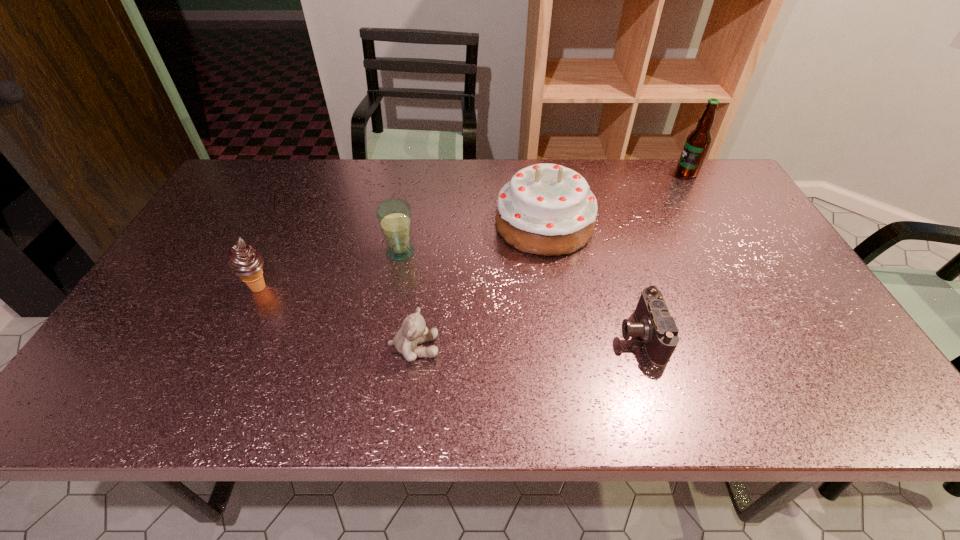
Locate an element on the screen. The height and width of the screenshot is (540, 960). free space located 0.050m on the label of the beer bottle is located at coordinates (660, 173).

This screenshot has height=540, width=960. Identify the location of free location located on the back of the second tallest object. (538, 185).

Image resolution: width=960 pixels, height=540 pixels. What are the coordinates of `vacant space situated on the back of the leftmost object` in the screenshot? It's located at (x=276, y=251).

This screenshot has height=540, width=960. What are the coordinates of `vacant space located on the front of the glass` in the screenshot? It's located at (383, 348).

Find the location of `free space located 0.300m on the face of the teddy bear`. free space located 0.300m on the face of the teddy bear is located at coordinates (574, 348).

Where is `free space located 0.100m on the front-facing side of the camera`? This screenshot has height=540, width=960. free space located 0.100m on the front-facing side of the camera is located at coordinates (575, 334).

Where is `free location located on the front-facing side of the camera`? This screenshot has height=540, width=960. free location located on the front-facing side of the camera is located at coordinates (549, 334).

The width and height of the screenshot is (960, 540). Find the location of `free point located 0.110m on the front-facing side of the camera`. free point located 0.110m on the front-facing side of the camera is located at coordinates (571, 334).

Identify the location of beer bottle situated at the far edge. (698, 141).

Locate an element on the screen. cake that is at the far edge is located at coordinates (546, 209).